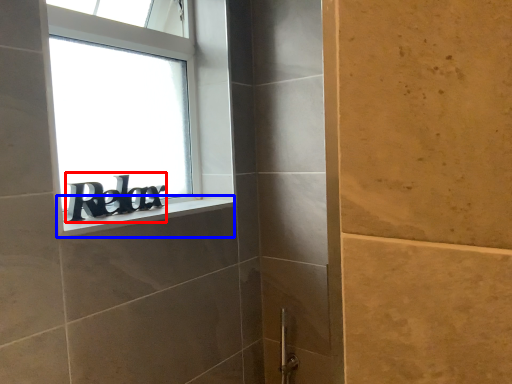
Question: Which object appears farthest to the camera in this image, writing (highlighted by a red box) or window sill (highlighted by a blue box)?

Choices:
 (A) writing
 (B) window sill

Answer: (A)